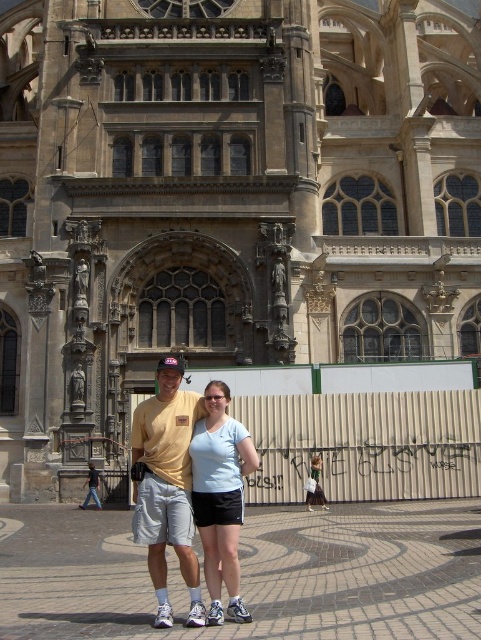
Consider the image. Which is more to the left, yellow t-shirt at center or light blue fabric shirt at center?

Positioned to the left is yellow t-shirt at center.

Who is taller, yellow t-shirt at center or light blue fabric shirt at center?

yellow t-shirt at center is taller.

This screenshot has width=481, height=640. Identify the location of yellow t-shirt at center. (166, 484).